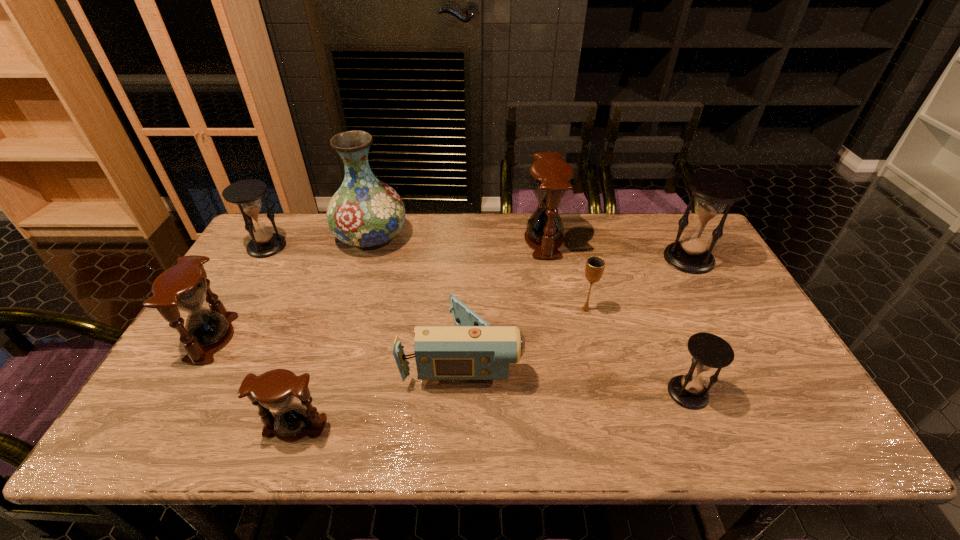
The width and height of the screenshot is (960, 540). In the image, there is a desktop. What are the coordinates of `vacant space at the near edge` in the screenshot? It's located at (740, 429).

The height and width of the screenshot is (540, 960). What are the coordinates of `vacant space at the right edge of the desktop` in the screenshot? It's located at (756, 318).

In order to click on free space at the far left corner of the desktop in this screenshot , I will do `click(284, 228)`.

The image size is (960, 540). In order to click on free space between the rightmost hourglass and the vase in this screenshot , I will do `click(530, 248)`.

Where is `free space between the chalice and the tallest object`? This screenshot has height=540, width=960. free space between the chalice and the tallest object is located at coordinates (478, 273).

You are a GUI agent. You are given a task and a screenshot of the screen. Output one action in this format:
    pyautogui.click(x=<x>, y=<y>)
    Task: Click on the blank region between the camcorder and the leftmost black hourglass
    
    Given the screenshot: What is the action you would take?
    pyautogui.click(x=365, y=299)

Where is `free space that is in between the rightmost object and the blue vase`? The height and width of the screenshot is (540, 960). free space that is in between the rightmost object and the blue vase is located at coordinates click(x=530, y=248).

Find the location of a particular element. The image size is (960, 540). empty space between the fifth object from left to right and the farthest brown hourglass is located at coordinates (503, 296).

Image resolution: width=960 pixels, height=540 pixels. In order to click on vacant region between the vase and the second brown hourglass from left to right in this screenshot , I will do `click(333, 332)`.

The image size is (960, 540). Find the location of `vacant region between the second smallest black hourglass and the tallest object`. vacant region between the second smallest black hourglass and the tallest object is located at coordinates (319, 242).